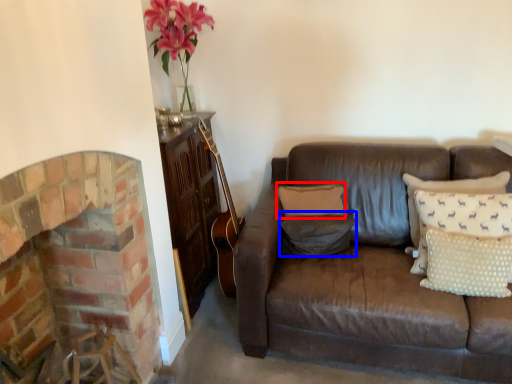
Question: Among these objects, which one is nearest to the camera, pillow (highlighted by a red box) or pillow (highlighted by a blue box)?

Choices:
 (A) pillow
 (B) pillow

Answer: (B)